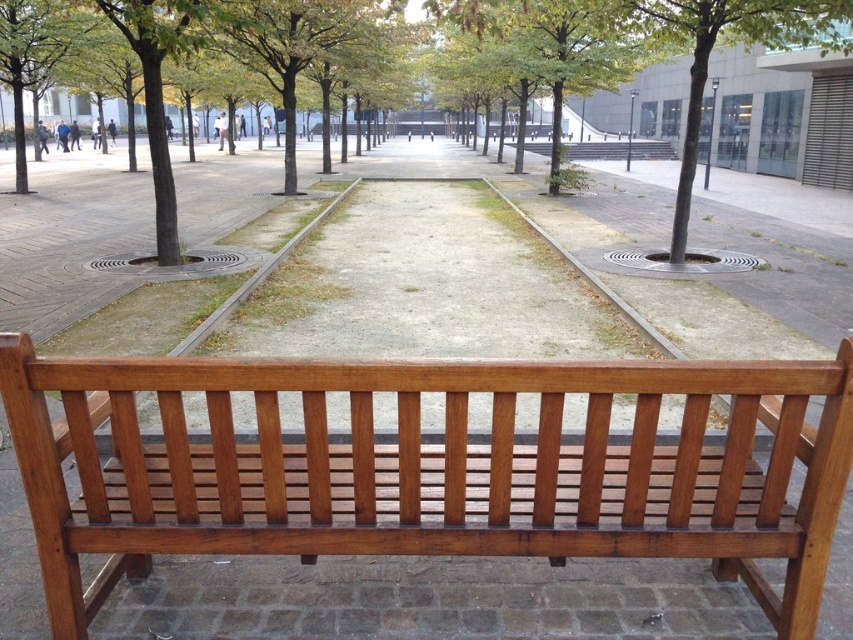
Which is more to the right, shiny brown wood bench at center or green leafy tree at upper right?

green leafy tree at upper right is more to the right.

Who is shorter, shiny brown wood bench at center or green leafy tree at upper right?

shiny brown wood bench at center is shorter.

Who is more forward, (849, 368) or (693, 113)?

Point (849, 368)

Find the location of a particular element. This screenshot has height=640, width=853. shiny brown wood bench at center is located at coordinates (428, 468).